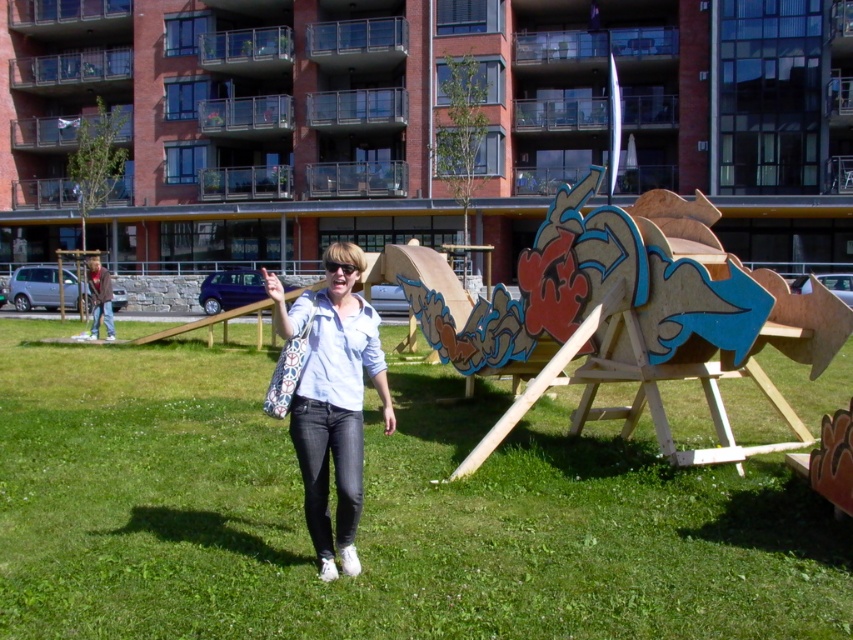
Between green grass at center and matte white shirt at center, which one appears on the right side from the viewer's perspective?

Positioned to the right is green grass at center.

Is green grass at center below matte white shirt at center?

Yes, green grass at center is below matte white shirt at center.

Who is more forward, (734, 602) or (341, 436)?

Point (734, 602)

Where is `green grass at center`? This screenshot has width=853, height=640. green grass at center is located at coordinates (376, 515).

Does point (757, 445) come closer to viewer compared to point (355, 276)?

That is False.

Is wooden sculpture at center to the right of matte white shirt at center from the viewer's perspective?

Yes, wooden sculpture at center is to the right of matte white shirt at center.

Does point (654, 312) come in front of point (297, 396)?

No, it is not.

You are a GUI agent. You are given a task and a screenshot of the screen. Output one action in this format:
    pyautogui.click(x=<x>, y=<y>)
    Task: Click on the wooden sculpture at center
    This screenshot has height=640, width=853.
    Given the screenshot: What is the action you would take?
    pyautogui.click(x=625, y=305)

Which is more to the right, green grass at center or wooden sculpture at center?

From the viewer's perspective, green grass at center appears more on the right side.

Looking at this image, can you confirm if green grass at center is wider than wooden sculpture at center?

Correct, the width of green grass at center exceeds that of wooden sculpture at center.

Describe the element at coordinates (376, 515) in the screenshot. I see `green grass at center` at that location.

At what (x,y) coordinates should I click in order to perform the action: click on green grass at center. Please return your answer as a coordinate pair (x, y). This screenshot has width=853, height=640. Looking at the image, I should click on (376, 515).